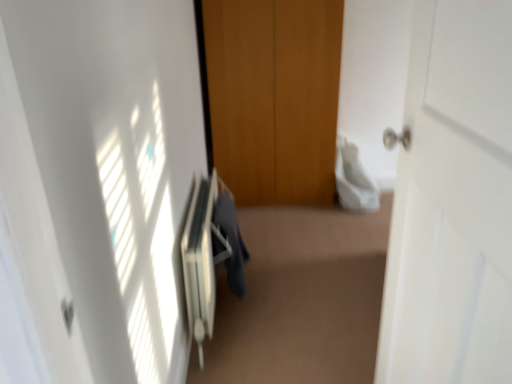
Question: Is the surface of dark gray fabric at center in direct contact with white matte door at right?

Choices:
 (A) no
 (B) yes

Answer: (A)

Question: Is dark gray fabric at center turned away from white matte door at right?

Choices:
 (A) no
 (B) yes

Answer: (A)

Question: Is white matte door at right a part of dark gray fabric at center?

Choices:
 (A) yes
 (B) no

Answer: (B)

Question: Does dark gray fabric at center have a lesser height compared to white matte door at right?

Choices:
 (A) no
 (B) yes

Answer: (B)

Question: Is dark gray fabric at center further to the viewer compared to white matte door at right?

Choices:
 (A) yes
 (B) no

Answer: (A)

Question: From the image's perspective, is white matte door at right positioned above or below dark gray fabric at center?

Choices:
 (A) below
 (B) above

Answer: (B)

Question: In terms of width, does white matte door at right look wider or thinner when compared to dark gray fabric at center?

Choices:
 (A) wide
 (B) thin

Answer: (A)

Question: In terms of height, does white matte door at right look taller or shorter compared to dark gray fabric at center?

Choices:
 (A) short
 (B) tall

Answer: (B)

Question: From a real-world perspective, is white matte door at right positioned above or below dark gray fabric at center?

Choices:
 (A) below
 (B) above

Answer: (B)

Question: Is dark gray fabric at center to the left or to the right of white plastic radiator at center in the image?

Choices:
 (A) left
 (B) right

Answer: (B)

Question: Is dark gray fabric at center in front of or behind white plastic radiator at center in the image?

Choices:
 (A) behind
 (B) front

Answer: (A)

Question: Is dark gray fabric at center taller or shorter than white plastic radiator at center?

Choices:
 (A) short
 (B) tall

Answer: (A)

Question: From a real-world perspective, is dark gray fabric at center above or below white plastic radiator at center?

Choices:
 (A) above
 (B) below

Answer: (A)

Question: Looking at their shapes, would you say white plastic radiator at center is wider or thinner than dark gray fabric at center?

Choices:
 (A) thin
 (B) wide

Answer: (B)

Question: From a real-world perspective, is white plastic radiator at center above or below dark gray fabric at center?

Choices:
 (A) below
 (B) above

Answer: (A)